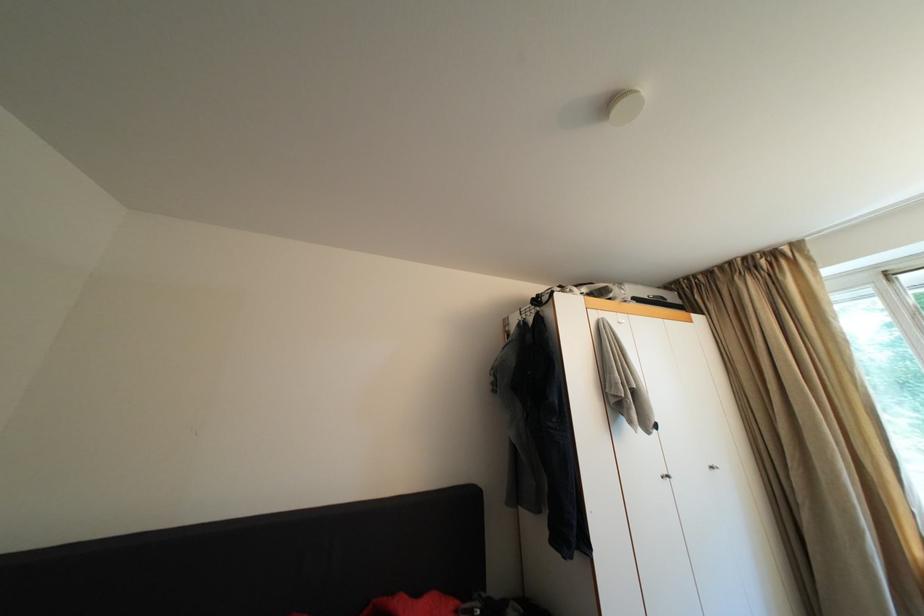
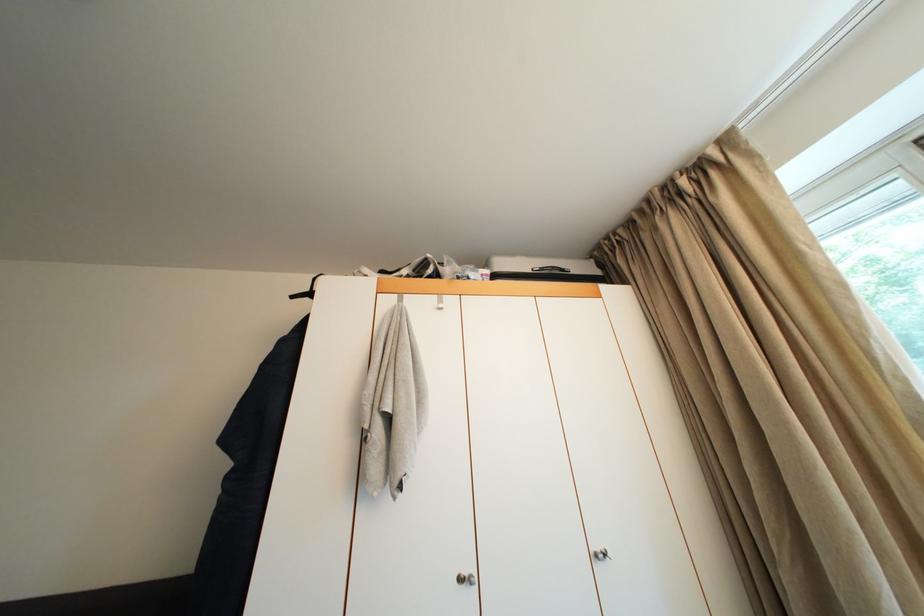
The images are taken continuously from a first-person perspective. In which direction are you moving?

The cameraman walked toward right, forward.